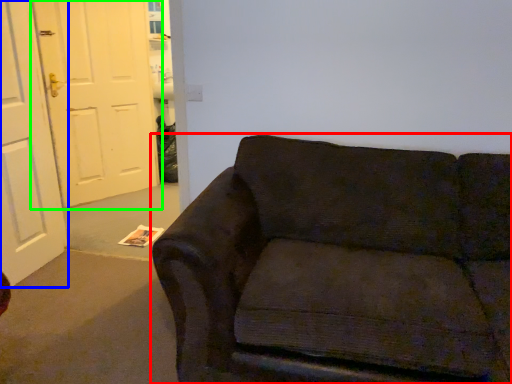
Question: Which is nearer to the studio couch (highlighted by a red box)? door (highlighted by a blue box) or door (highlighted by a green box).

Choices:
 (A) door
 (B) door

Answer: (A)